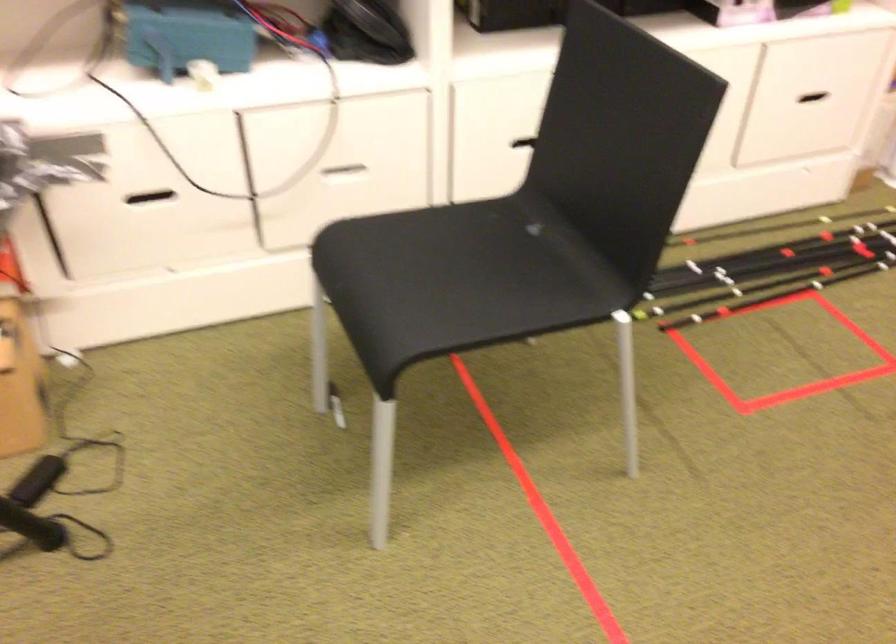
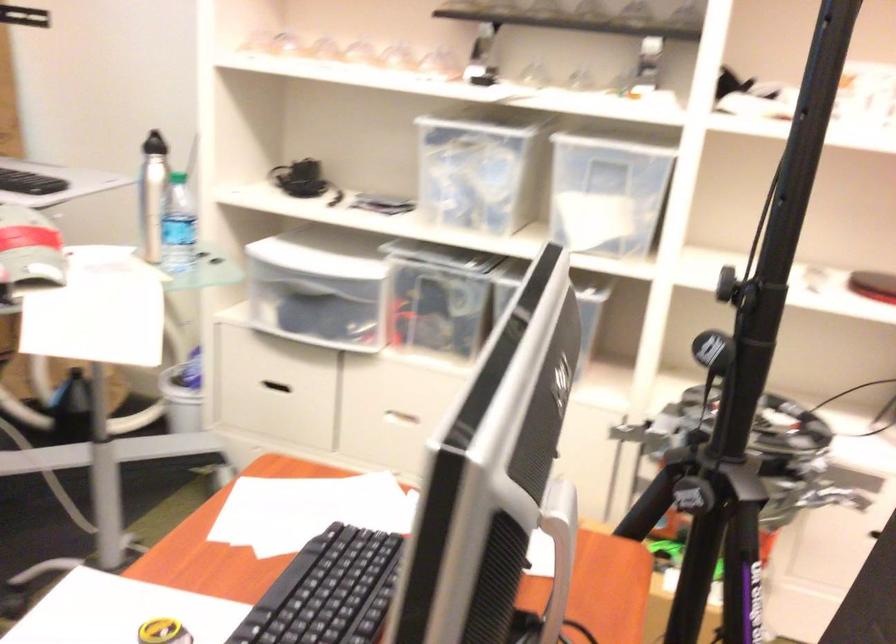
Question: The images are taken continuously from a first-person perspective. In which direction is your viewpoint rotating?

Choices:
 (A) Left
 (B) Right
 (C) Up
 (D) Down

Answer: (A)